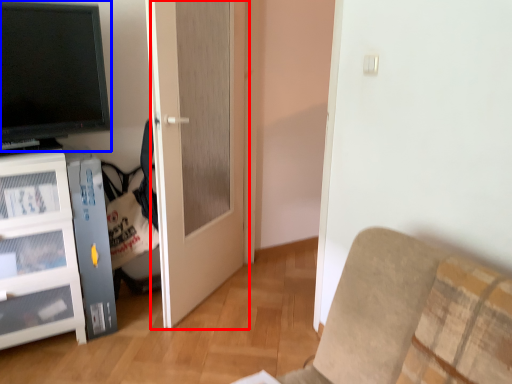
Question: Which point is closer to the camera, door (highlighted by a red box) or television (highlighted by a blue box)?

Choices:
 (A) door
 (B) television

Answer: (B)